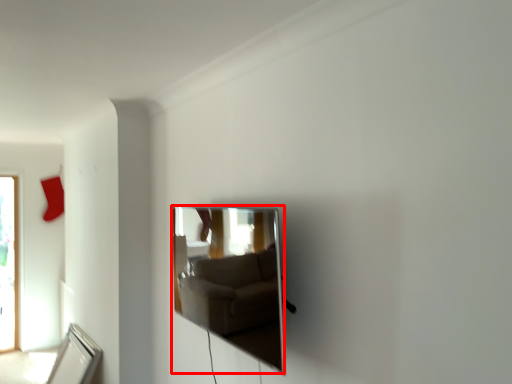
Question: From the image's perspective, considering the relative positions of mirror (annotated by the red box) and mirror in the image provided, where is mirror (annotated by the red box) located with respect to the staircase?

Choices:
 (A) below
 (B) above

Answer: (B)